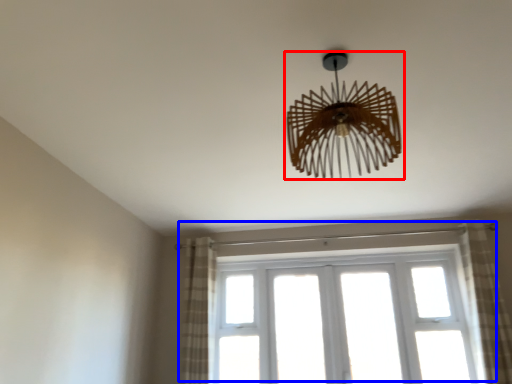
Question: Which of the following is the closest to the observer, lamp (highlighted by a red box) or window (highlighted by a blue box)?

Choices:
 (A) lamp
 (B) window

Answer: (A)